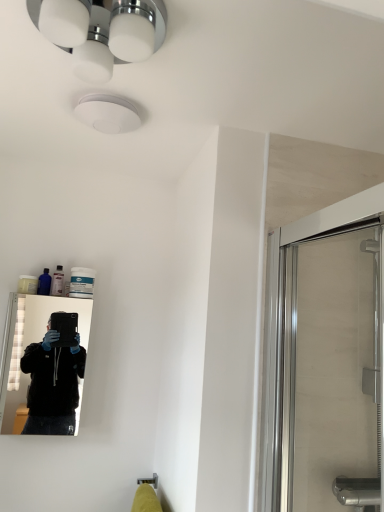
What is the approximate height of transparent glass shower door at right?

transparent glass shower door at right is 30.64 inches in height.

Locate an element on the screen. The width and height of the screenshot is (384, 512). translucent plastic bottle at upper left is located at coordinates (57, 282).

Looking at this image, is white glossy light fixture at upper center facing away from translucent plastic bottle at upper left?

No, translucent plastic bottle at upper left is not at the back of white glossy light fixture at upper center.

Find the location of a particular element. This screenshot has width=384, height=512. toiletry located below the white glossy light fixture at upper center (from the image's perspective) is located at coordinates (57, 282).

From a real-world perspective, who is located higher, white glossy light fixture at upper center or translucent plastic bottle at upper left?

In real-world perspective, white glossy light fixture at upper center is above.

Could you measure the distance between white glossy light fixture at upper center and translucent plastic bottle at upper left?

39.36 inches.

How different are the orientations of transparent glass shower door at right and black glossy mirror at left in degrees?

There is a 80.5-degree angle between the facing directions of transparent glass shower door at right and black glossy mirror at left.

From the image's perspective, relative to black glossy mirror at left, is transparent glass shower door at right above or below?

transparent glass shower door at right is above black glossy mirror at left.

Which is in front, point (308, 455) or point (22, 294)?

The point (308, 455) is closer to the camera.

Is transparent glass shower door at right inside or outside of black glossy mirror at left?

transparent glass shower door at right cannot be found inside black glossy mirror at left.

Can you tell me how much transparent glass shower door at right and white glossy light fixture at upper center differ in facing direction?

The angle between the facing direction of transparent glass shower door at right and the facing direction of white glossy light fixture at upper center is 99.8 degrees.

Is transparent glass shower door at right oriented towards white glossy light fixture at upper center?

Yes, transparent glass shower door at right is aimed at white glossy light fixture at upper center.

Find the location of a particular element. Image resolution: width=384 pixels, height=512 pixels. screen door lying behind the white glossy light fixture at upper center is located at coordinates (330, 371).

Is point (377, 440) positioned behind point (149, 4)?

Yes, it is.

Does black glossy mirror at left have a greater width compared to white glossy light fixture at upper center?

No.

Is black glossy mirror at left further to camera compared to white glossy light fixture at upper center?

Yes, black glossy mirror at left is behind white glossy light fixture at upper center.

Considering the relative sizes of translucent plastic bottle at upper left and black glossy mirror at left in the image provided, is translucent plastic bottle at upper left shorter than black glossy mirror at left?

Indeed, translucent plastic bottle at upper left has a lesser height compared to black glossy mirror at left.

Locate an element on the screen. This screenshot has width=384, height=512. toiletry above the black glossy mirror at left (from the image's perspective) is located at coordinates (57, 282).

Is translucent plastic bottle at upper left turned away from black glossy mirror at left?

No, translucent plastic bottle at upper left is not facing the opposite direction of black glossy mirror at left.

Which object is positioned more to the right, translucent plastic bottle at upper left or black glossy mirror at left?

translucent plastic bottle at upper left is more to the right.

In the scene shown: Does translucent plastic bottle at upper left appear on the right side of white glossy light fixture at upper center?

Incorrect, translucent plastic bottle at upper left is not on the right side of white glossy light fixture at upper center.

Is translucent plastic bottle at upper left facing towards white glossy light fixture at upper center?

Yes, translucent plastic bottle at upper left faces towards white glossy light fixture at upper center.

From the picture: Which object is further away from the camera taking this photo, translucent plastic bottle at upper left or white glossy light fixture at upper center?

translucent plastic bottle at upper left.

Is translucent plastic bottle at upper left not within white glossy light fixture at upper center?

translucent plastic bottle at upper left lies outside white glossy light fixture at upper center's area.

Between point (375, 444) and point (63, 279), which one is positioned in front?

The point (375, 444) is closer.

Can translucent plastic bottle at upper left be found inside transparent glass shower door at right?

Actually, translucent plastic bottle at upper left is outside transparent glass shower door at right.

From a real-world perspective, which object rests below the other?

transparent glass shower door at right is physically lower.

Locate an element on the screen. The width and height of the screenshot is (384, 512). screen door that is below the translucent plastic bottle at upper left (from the image's perspective) is located at coordinates (330, 371).

What are the coordinates of `toiletry located underneath the white glossy light fixture at upper center (from a real-world perspective)` in the screenshot? It's located at (57, 282).

Where is `mirror that is behind the transparent glass shower door at right`? The image size is (384, 512). mirror that is behind the transparent glass shower door at right is located at coordinates (30, 343).

When comparing their distances from transparent glass shower door at right, does white glossy light fixture at upper center or black glossy mirror at left seem further?

black glossy mirror at left lies further to transparent glass shower door at right than the other object.

Looking at the image, which one is located further to white glossy light fixture at upper center, transparent glass shower door at right or black glossy mirror at left?

Among the two, black glossy mirror at left is located further to white glossy light fixture at upper center.

In the scene shown: Looking at the image, which one is located closer to black glossy mirror at left, transparent glass shower door at right or white glossy light fixture at upper center?

Among the two, transparent glass shower door at right is located nearer to black glossy mirror at left.

Considering their positions, is translucent plastic bottle at upper left positioned further to white glossy light fixture at upper center than transparent glass shower door at right?

translucent plastic bottle at upper left lies further to white glossy light fixture at upper center than the other object.

Based on their spatial positions, is black glossy mirror at left or translucent plastic bottle at upper left further from white glossy light fixture at upper center?

black glossy mirror at left is positioned further to the anchor white glossy light fixture at upper center.

Considering their positions, is white glossy light fixture at upper center positioned further to transparent glass shower door at right than translucent plastic bottle at upper left?

Among the two, translucent plastic bottle at upper left is located further to transparent glass shower door at right.

Which object lies nearer to the anchor point transparent glass shower door at right, translucent plastic bottle at upper left or white glossy light fixture at upper center?

white glossy light fixture at upper center.

Looking at the image, which one is located further to translucent plastic bottle at upper left, white glossy light fixture at upper center or transparent glass shower door at right?

transparent glass shower door at right is positioned further to the anchor translucent plastic bottle at upper left.

Where is `screen door between white glossy light fixture at upper center and translucent plastic bottle at upper left from front to back`? This screenshot has width=384, height=512. screen door between white glossy light fixture at upper center and translucent plastic bottle at upper left from front to back is located at coordinates (x=330, y=371).

The width and height of the screenshot is (384, 512). Identify the location of screen door that lies between white glossy light fixture at upper center and black glossy mirror at left from top to bottom. (330, 371).

Find the location of a particular element. toiletry situated between black glossy mirror at left and transparent glass shower door at right from left to right is located at coordinates (57, 282).

At what (x,y) coordinates should I click in order to perform the action: click on mirror between white glossy light fixture at upper center and translucent plastic bottle at upper left along the z-axis. Please return your answer as a coordinate pair (x, y). Looking at the image, I should click on (30, 343).